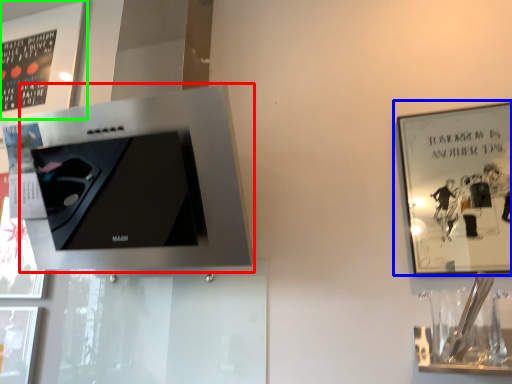
Question: Which object is the farthest from appliance (highlighted by a red box)? Choose among these: picture frame (highlighted by a blue box) or picture frame (highlighted by a green box).

Choices:
 (A) picture frame
 (B) picture frame

Answer: (A)